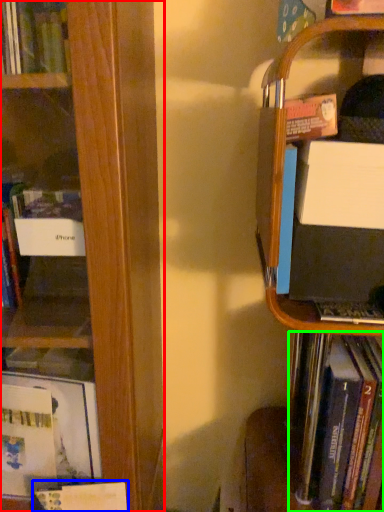
Question: Which object is the farthest from book (highlighted by a red box)? Choose among these: book (highlighted by a blue box) or book (highlighted by a green box).

Choices:
 (A) book
 (B) book

Answer: (B)